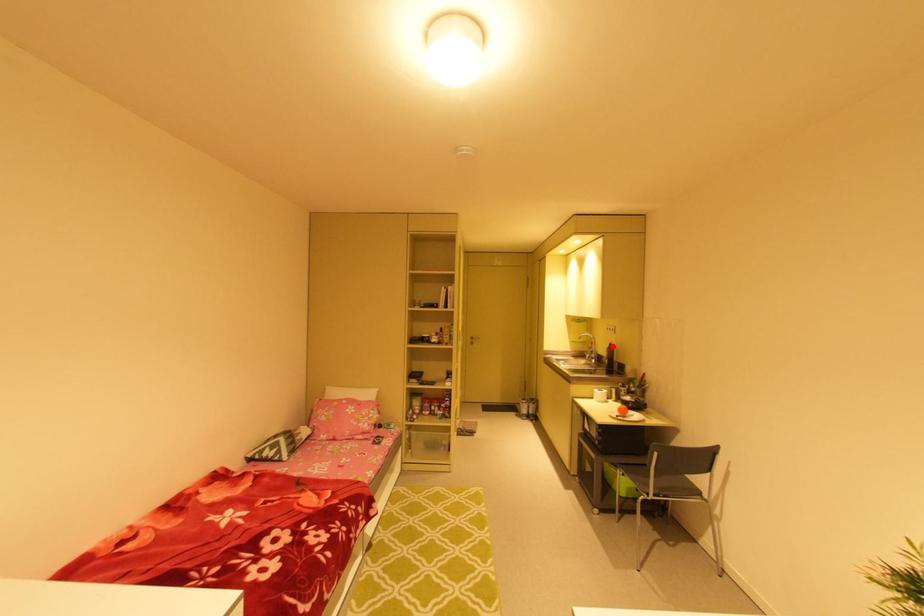
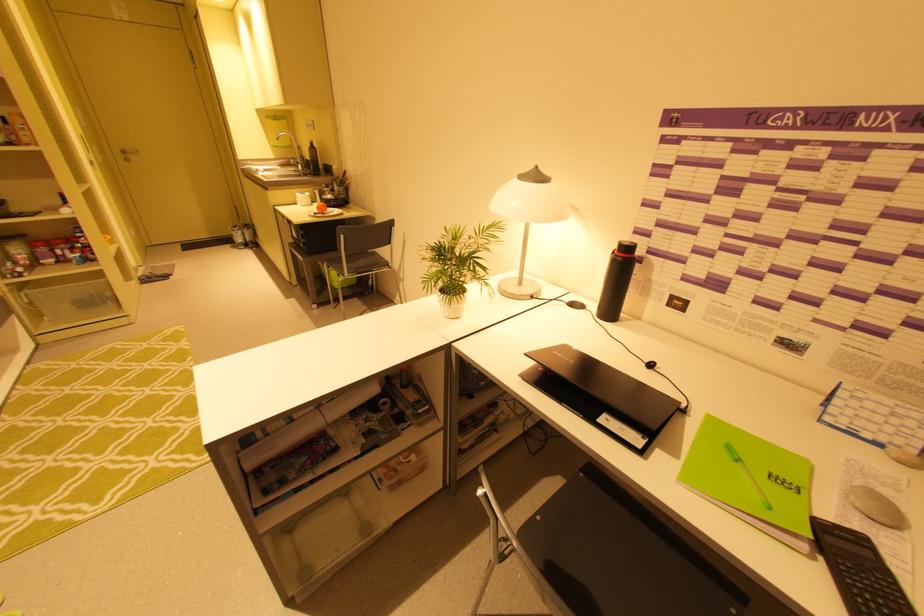
Find the pixel in the second image that matches the highlighted location in the first image.

(313, 146)